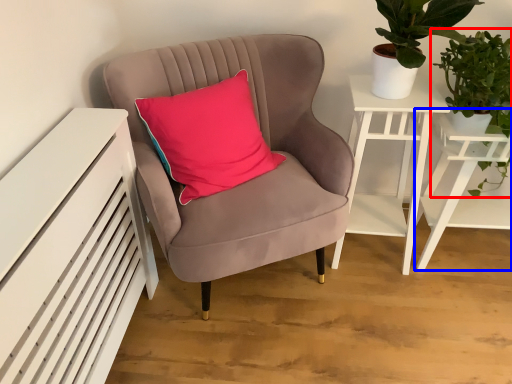
Question: Which object appears farthest to the camera in this image, houseplant (highlighted by a red box) or table (highlighted by a blue box)?

Choices:
 (A) houseplant
 (B) table

Answer: (B)